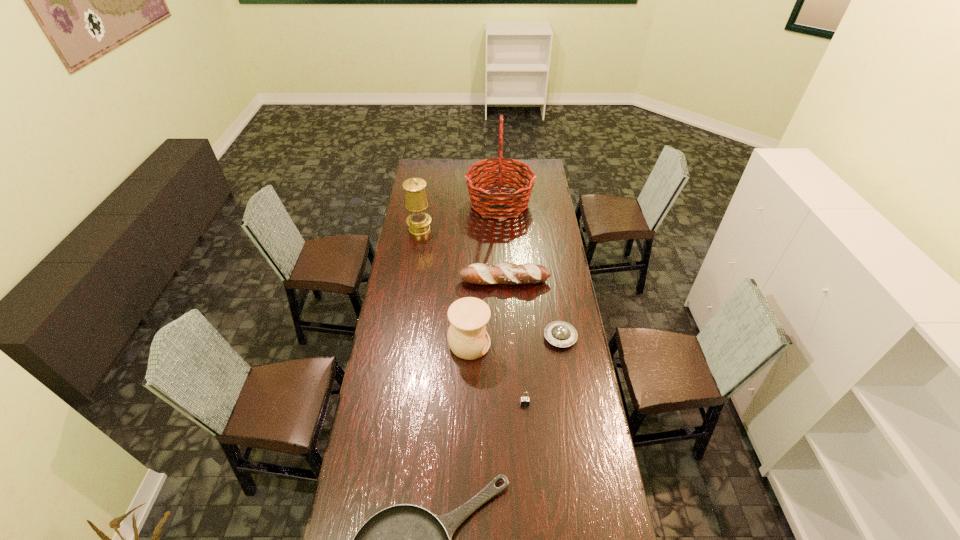
In the image, there is a desktop. Identify the location of vacant space at the far left corner. The image size is (960, 540). (434, 166).

Identify the location of vacant space at the far right corner of the desktop. (545, 179).

At what (x,y) coordinates should I click in order to perform the action: click on free spot between the third farthest object and the sixth tallest object. Please return your answer as a coordinate pair (x, y). This screenshot has width=960, height=540. Looking at the image, I should click on (533, 309).

The height and width of the screenshot is (540, 960). Find the location of `vacant space in between the pottery and the padlock`. vacant space in between the pottery and the padlock is located at coordinates (497, 374).

Where is `vacant area that lies between the third farthest object and the tallest object`? The image size is (960, 540). vacant area that lies between the third farthest object and the tallest object is located at coordinates (502, 242).

This screenshot has height=540, width=960. What are the coordinates of `free space between the second nearest object and the third farthest object` in the screenshot? It's located at (515, 342).

This screenshot has height=540, width=960. Find the location of `unoccupied area between the fifth shortest object and the saucer`. unoccupied area between the fifth shortest object and the saucer is located at coordinates (515, 340).

Locate an element on the screen. This screenshot has width=960, height=540. vacant area between the second shortest object and the pottery is located at coordinates (515, 340).

Select which object appears as the third closest to the oil lamp. Please provide its 2D coordinates. Your answer should be formatted as a tuple, i.e. [(x, y)], where the tuple contains the x and y coordinates of a point satisfying the conditions above.

[(467, 337)]

What are the coordinates of `object that is the sixth closest to the pottery` in the screenshot? It's located at (499, 203).